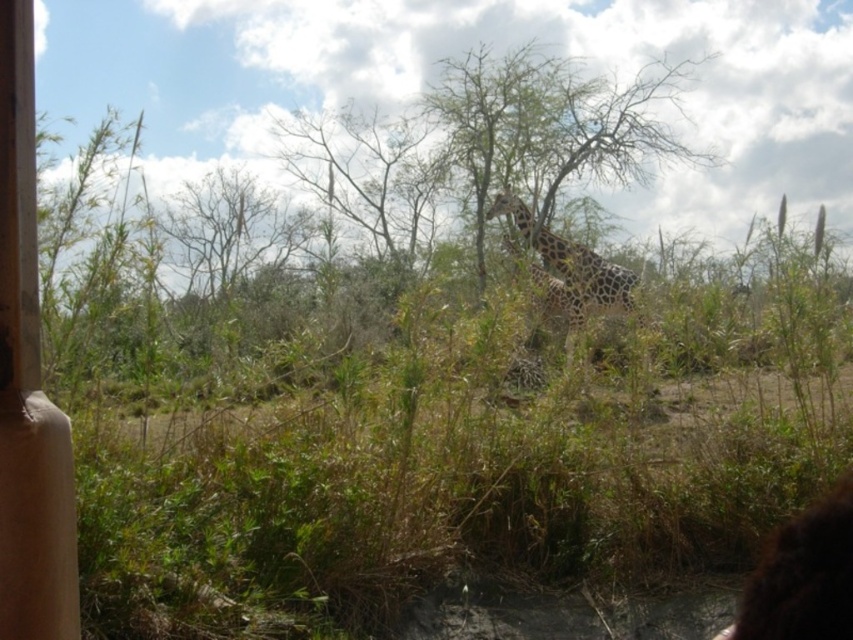
Is point (517, 570) more distant than point (598, 168)?

No, it is not.

This screenshot has width=853, height=640. Describe the element at coordinates (457, 448) in the screenshot. I see `green grass at center` at that location.

Find the location of `green grass at center`. green grass at center is located at coordinates (457, 448).

Does green grass at center have a greater width compared to spotted-patterned giraffe at center?

Yes.

Is point (637, 321) positioned before point (556, 241)?

Yes, point (637, 321) is closer to viewer.

Where is `green grass at center`? The width and height of the screenshot is (853, 640). green grass at center is located at coordinates (457, 448).

Between point (554, 195) and point (503, 198), which one is positioned in front?

Point (503, 198) is in front.

Does bare wood tree at center have a greater height compared to spotted-patterned giraffe at center?

No.

Between point (599, 150) and point (614, 268), which one is positioned in front?

Positioned in front is point (614, 268).

The height and width of the screenshot is (640, 853). Find the location of `bare wood tree at center`. bare wood tree at center is located at coordinates (548, 125).